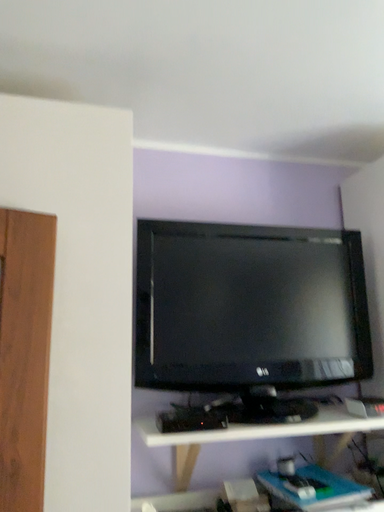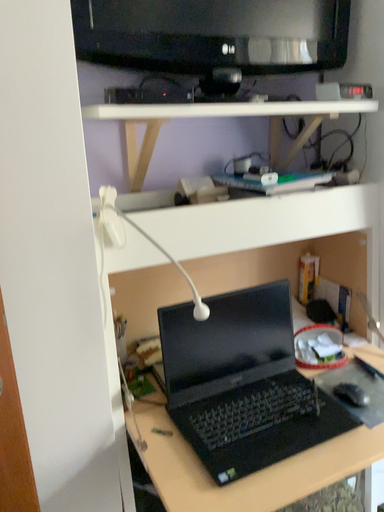
Question: Which way did the camera rotate in the video?

Choices:
 (A) rotated right
 (B) rotated left

Answer: (A)